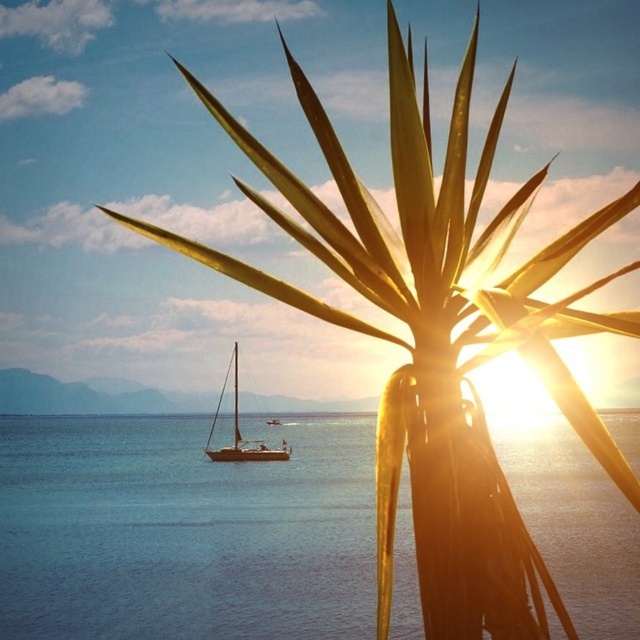
Question: Which of the following is the farthest from the observer?

Choices:
 (A) blue water at center
 (B) white glossy sailboat at center

Answer: (B)

Question: Which point is closer to the camera?

Choices:
 (A) (232, 573)
 (B) (262, 442)

Answer: (A)

Question: Considering the relative positions of blue water at center and white glossy sailboat at center in the image provided, where is blue water at center located with respect to white glossy sailboat at center?

Choices:
 (A) left
 (B) right

Answer: (A)

Question: From the image, what is the correct spatial relationship of blue water at center in relation to white glossy sailboat at center?

Choices:
 (A) above
 (B) below

Answer: (B)

Question: Does blue water at center come in front of white glossy sailboat at center?

Choices:
 (A) yes
 (B) no

Answer: (A)

Question: Which of the following is the closest to the observer?

Choices:
 (A) white glossy sailboat at center
 (B) blue water at center

Answer: (B)